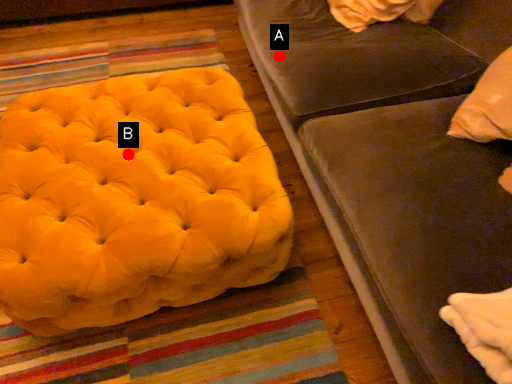
Question: Two points are circled on the image, labeled by A and B beside each circle. Which point appears farthest from the camera in this image?

Choices:
 (A) A is further
 (B) B is further

Answer: (A)